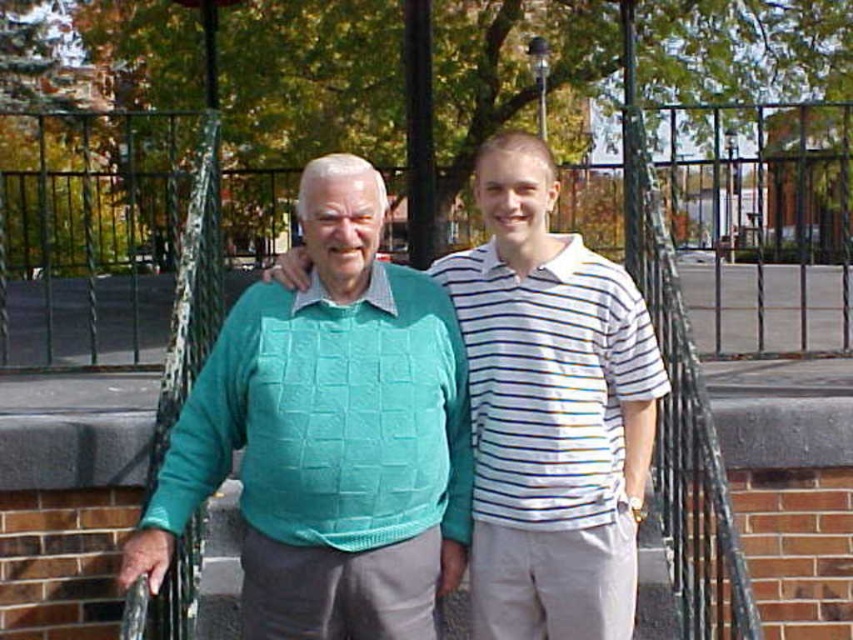
Is teal knitted sweater at center positioned behind white striped polo shirt at center?

No, teal knitted sweater at center is in front of white striped polo shirt at center.

Image resolution: width=853 pixels, height=640 pixels. In order to click on teal knitted sweater at center in this screenshot , I will do (329, 435).

Does point (293, 397) lie in front of point (495, 182)?

Yes, it is.

Locate an element on the screen. The height and width of the screenshot is (640, 853). teal knitted sweater at center is located at coordinates (329, 435).

You are a GUI agent. You are given a task and a screenshot of the screen. Output one action in this format:
    pyautogui.click(x=<x>, y=<y>)
    Task: Click on the teal knitted sweater at center
    The height and width of the screenshot is (640, 853).
    Given the screenshot: What is the action you would take?
    pyautogui.click(x=329, y=435)

Which is above, teal knitted sweater at center or green wire fence at center?

Positioned higher is green wire fence at center.

You are a GUI agent. You are given a task and a screenshot of the screen. Output one action in this format:
    pyautogui.click(x=<x>, y=<y>)
    Task: Click on the teal knitted sweater at center
    The width and height of the screenshot is (853, 640).
    Given the screenshot: What is the action you would take?
    (x=329, y=435)

Who is positioned more to the left, green wire fence at center or white striped polo shirt at center?

From the viewer's perspective, green wire fence at center appears more on the left side.

Between point (669, 170) and point (605, 632), which one is positioned behind?

Point (669, 170)

Identify the location of green wire fence at center. [x=759, y=221].